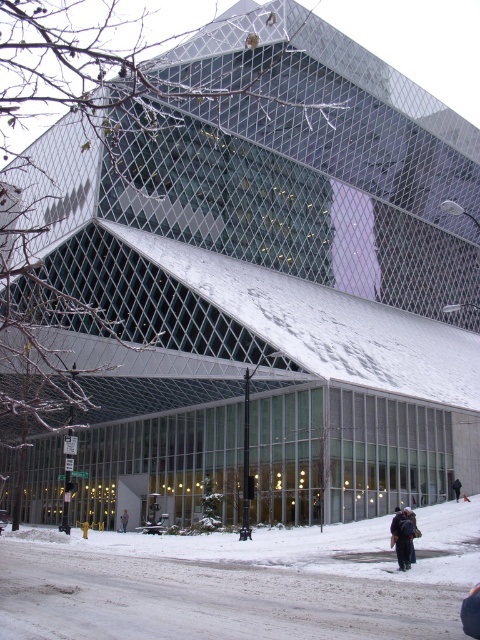
Question: Which object is closer to the camera taking this photo?

Choices:
 (A) dark gray backpack at lower right
 (B) light gray knit sweater at lower center
 (C) dark gray jacket at lower right
 (D) metallic silver car at lower left

Answer: (A)

Question: Which point is closer to the camera taking this photo?

Choices:
 (A) coord(457,497)
 (B) coord(123,515)
 (C) coord(6,520)

Answer: (A)

Question: Is metallic silver car at lower left further to camera compared to dark gray jacket at lower right?

Choices:
 (A) no
 (B) yes

Answer: (A)

Question: Which point is farther from the camera taking this photo?

Choices:
 (A) click(415, 525)
 (B) click(122, 524)

Answer: (B)

Question: Can you confirm if dark gray jacket at lower right is positioned below light gray knit sweater at lower center?

Choices:
 (A) yes
 (B) no

Answer: (B)

Question: Can you confirm if metallic silver car at lower left is positioned to the right of dark gray jacket at lower right?

Choices:
 (A) no
 (B) yes

Answer: (A)